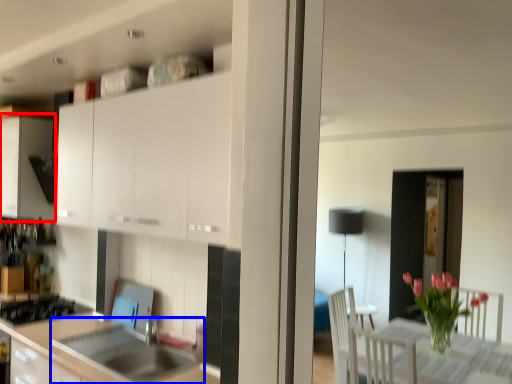
Question: Which object is further to the camera taking this photo, cabinetry (highlighted by a red box) or sink (highlighted by a blue box)?

Choices:
 (A) cabinetry
 (B) sink

Answer: (A)